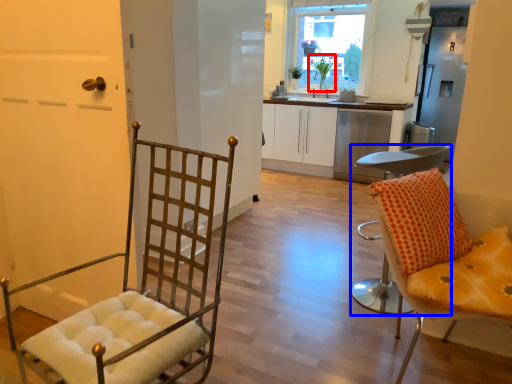
Question: Which object is further to the camera taking this photo, houseplant (highlighted by a red box) or chair (highlighted by a blue box)?

Choices:
 (A) houseplant
 (B) chair

Answer: (A)